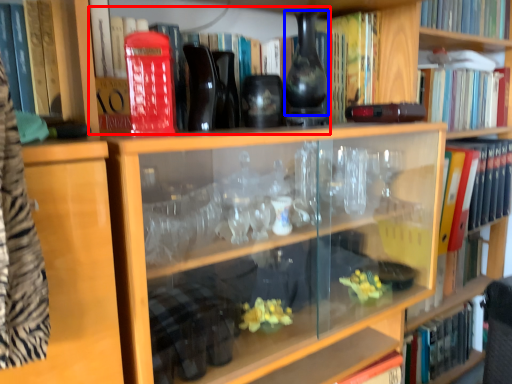
Question: Which object is further to the camera taking this photo, book (highlighted by a red box) or glass vase (highlighted by a blue box)?

Choices:
 (A) book
 (B) glass vase

Answer: (B)